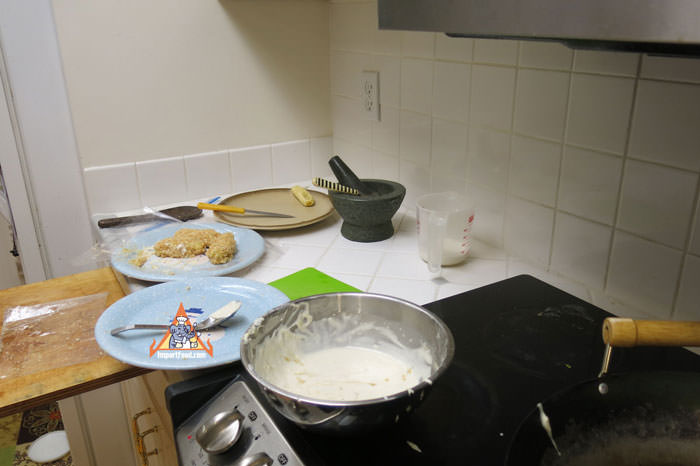
The width and height of the screenshot is (700, 466). Find the location of `silver bowl`. silver bowl is located at coordinates (379, 404).